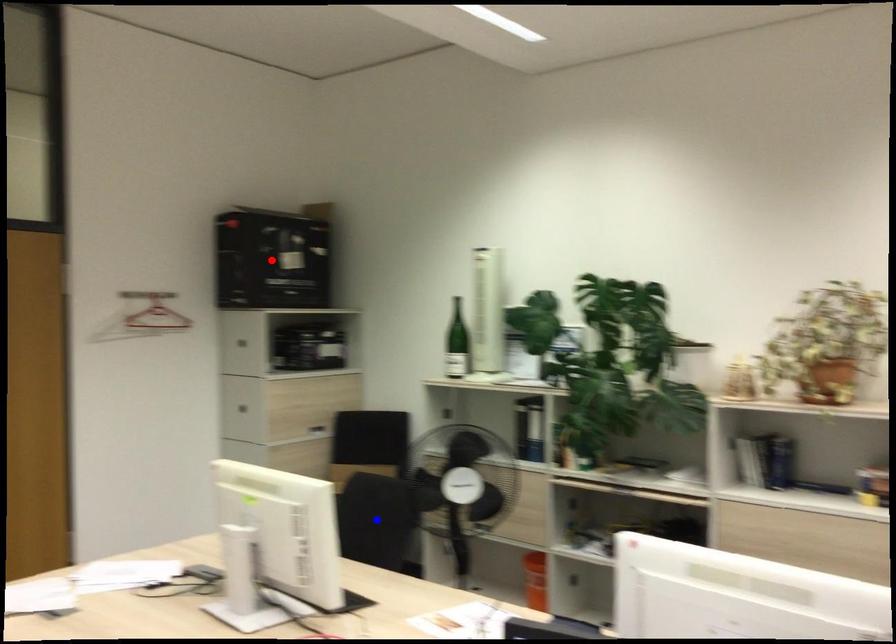
Question: Two points are marked on the image. Which point is closer to the camera?

Choices:
 (A) Blue point is closer.
 (B) Red point is closer.

Answer: (A)